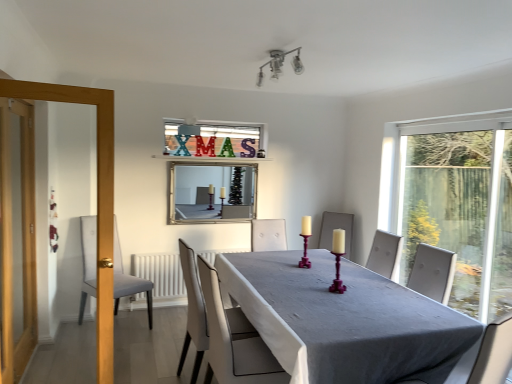
Find the location of `free spot in front of gray fabric chair at left, which is counted as the 2th chair, starting from the right`. free spot in front of gray fabric chair at left, which is counted as the 2th chair, starting from the right is located at coordinates (96, 350).